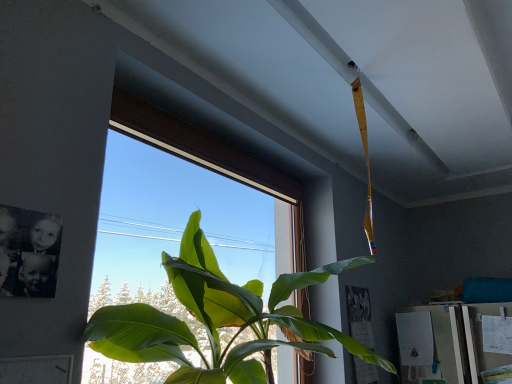
Question: Can you confirm if transparent glass window at center is taller than green leafy plant at center?

Choices:
 (A) no
 (B) yes

Answer: (B)

Question: From a real-world perspective, is transparent glass window at center located beneath green leafy plant at center?

Choices:
 (A) yes
 (B) no

Answer: (B)

Question: Considering the relative sizes of transparent glass window at center and green leafy plant at center in the image provided, is transparent glass window at center thinner than green leafy plant at center?

Choices:
 (A) no
 (B) yes

Answer: (B)

Question: Considering the relative sizes of transparent glass window at center and green leafy plant at center in the image provided, is transparent glass window at center shorter than green leafy plant at center?

Choices:
 (A) no
 (B) yes

Answer: (A)

Question: Is green leafy plant at center surrounded by transparent glass window at center?

Choices:
 (A) no
 (B) yes

Answer: (A)

Question: Considering the relative sizes of transparent glass window at center and green leafy plant at center in the image provided, is transparent glass window at center bigger than green leafy plant at center?

Choices:
 (A) no
 (B) yes

Answer: (A)

Question: Can you confirm if green leafy plant at center is positioned to the left of transparent glass window at center?

Choices:
 (A) no
 (B) yes

Answer: (A)

Question: Is transparent glass window at center located within green leafy plant at center?

Choices:
 (A) yes
 (B) no

Answer: (A)

Question: From the image's perspective, is green leafy plant at center located beneath transparent glass window at center?

Choices:
 (A) yes
 (B) no

Answer: (A)

Question: Is transparent glass window at center at the back of green leafy plant at center?

Choices:
 (A) yes
 (B) no

Answer: (A)

Question: Can you confirm if green leafy plant at center is wider than transparent glass window at center?

Choices:
 (A) no
 (B) yes

Answer: (B)

Question: Is green leafy plant at center completely or partially outside of transparent glass window at center?

Choices:
 (A) yes
 (B) no

Answer: (A)

Question: From a real-world perspective, is transparent glass window at center physically located above or below green leafy plant at center?

Choices:
 (A) below
 (B) above

Answer: (B)